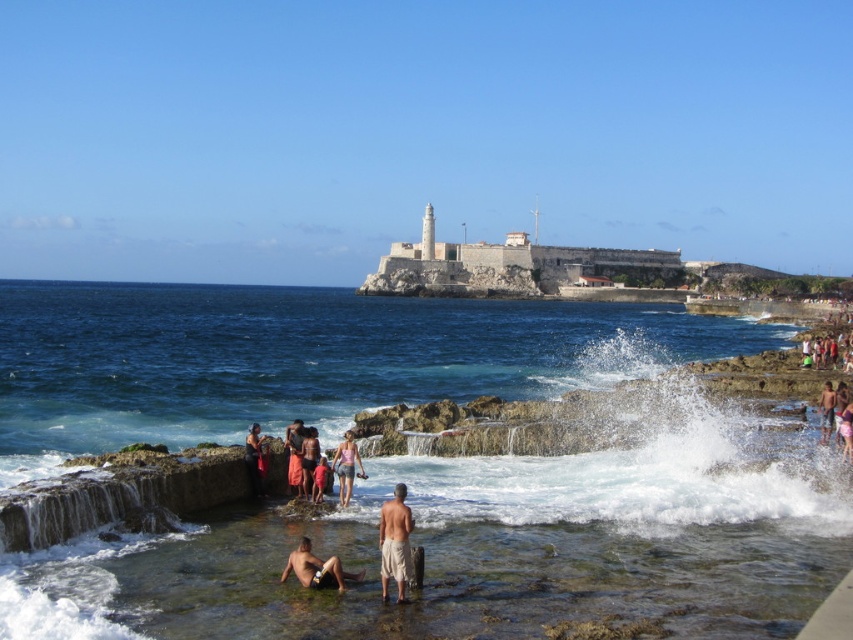
Question: Can you confirm if tan skin human at lower center is positioned to the left of matte pink shorts at center?

Choices:
 (A) yes
 (B) no

Answer: (B)

Question: Is tan cotton shorts at lower center to the right of pink fabric shorts at lower right from the viewer's perspective?

Choices:
 (A) yes
 (B) no

Answer: (B)

Question: Which object appears farthest from the camera in this image?

Choices:
 (A) light brown skin at lower right
 (B) pink fabric shorts at lower right
 (C) clear blue water at center
 (D) orange fabric dress at center

Answer: (A)

Question: Which object is farther from the camera taking this photo?

Choices:
 (A) tan cotton shorts at lower center
 (B) light brown skin at lower right

Answer: (B)

Question: Is tan cotton shorts at lower center positioned before orange fabric dress at center?

Choices:
 (A) yes
 (B) no

Answer: (A)

Question: Which point is farther to the camera?

Choices:
 (A) (309, 440)
 (B) (830, 406)
 (C) (489, 461)

Answer: (B)